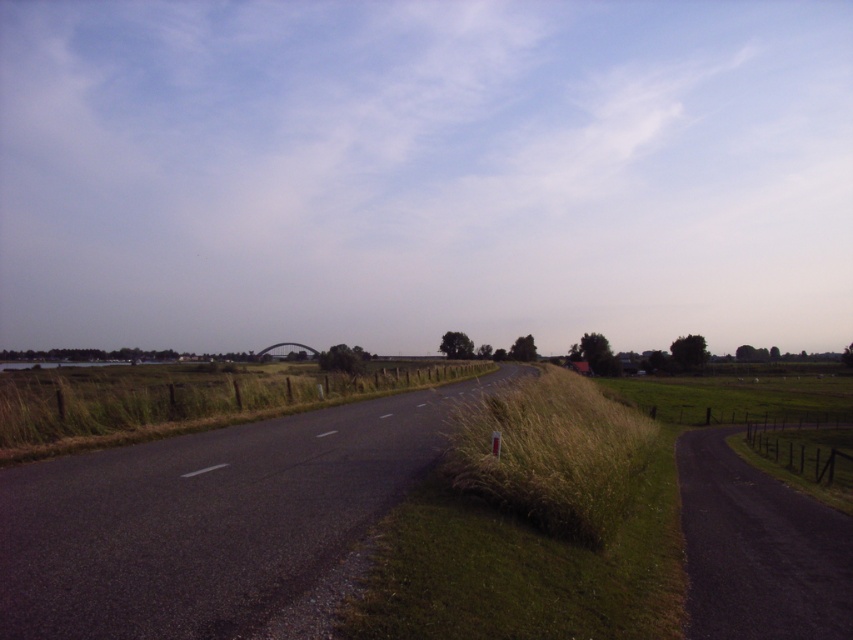
Who is taller, brown grassy patch at center or green grassy at left?

brown grassy patch at center

Is brown grassy patch at center positioned behind green grassy at left?

No, brown grassy patch at center is in front of green grassy at left.

The image size is (853, 640). What do you see at coordinates (552, 452) in the screenshot? I see `brown grassy patch at center` at bounding box center [552, 452].

In order to click on brown grassy patch at center in this screenshot , I will do `click(552, 452)`.

Is point (534, 554) positioned in front of point (190, 380)?

Yes, it is.

Can you confirm if green grassy at center is shorter than green grassy at left?

Incorrect, green grassy at center's height does not fall short of green grassy at left's.

Find the location of a particular element. green grassy at center is located at coordinates (529, 540).

Which is more to the left, green grassy at center or brown grassy patch at center?

From the viewer's perspective, green grassy at center appears more on the left side.

Between point (451, 545) and point (479, 483), which one is positioned in front?

Point (451, 545)

The width and height of the screenshot is (853, 640). Describe the element at coordinates (529, 540) in the screenshot. I see `green grassy at center` at that location.

At what (x,y) coordinates should I click in order to perform the action: click on green grassy at center. Please return your answer as a coordinate pair (x, y). The width and height of the screenshot is (853, 640). Looking at the image, I should click on (529, 540).